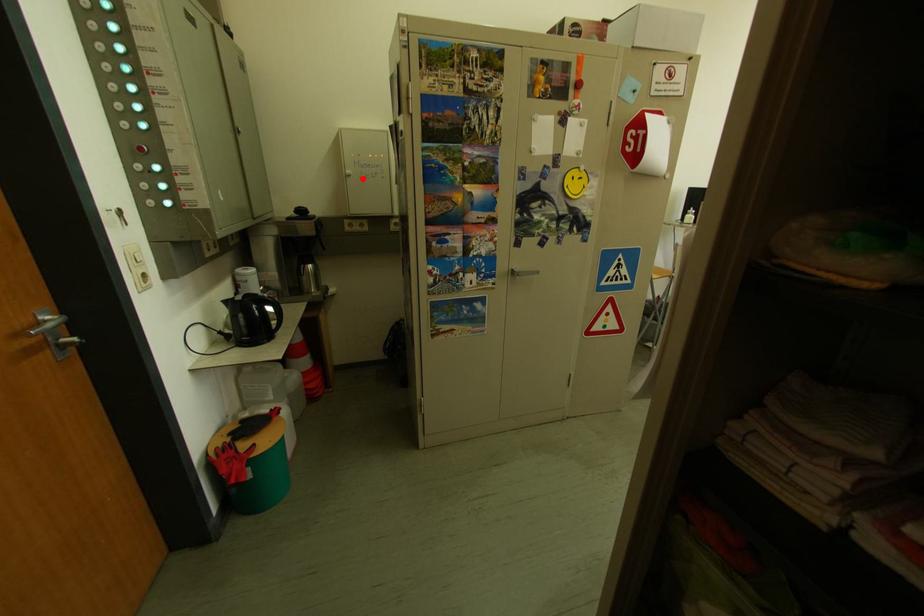
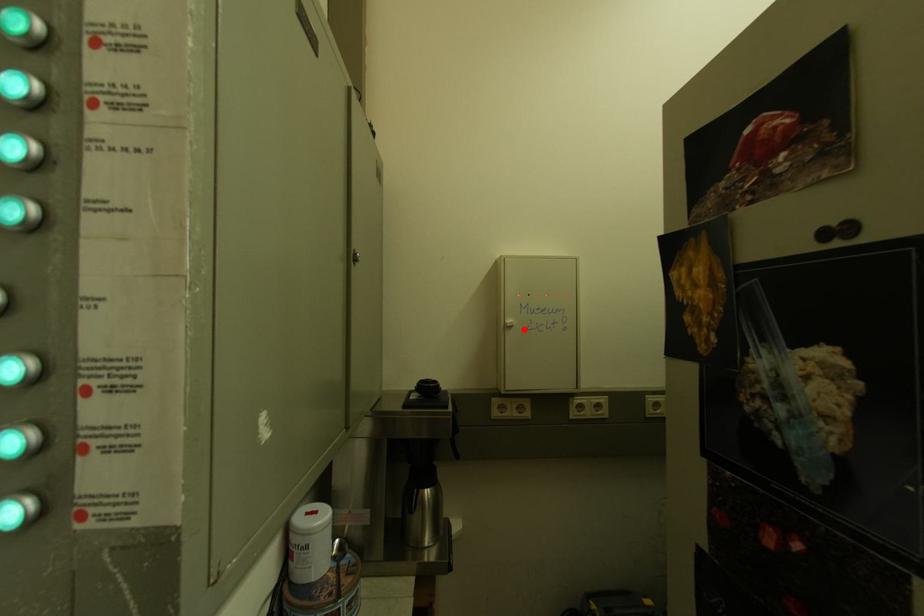
I am providing you with two images of the same scene from different viewpoints. A red point is marked on the first image and another point is marked on the second image. Is the marked point in image1 the same physical position as the marked point in image2?

Yes